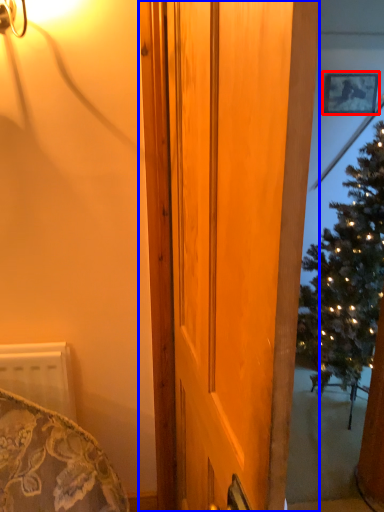
Question: Which of the following is the farthest to the observer, picture frame (highlighted by a red box) or door (highlighted by a blue box)?

Choices:
 (A) picture frame
 (B) door

Answer: (A)